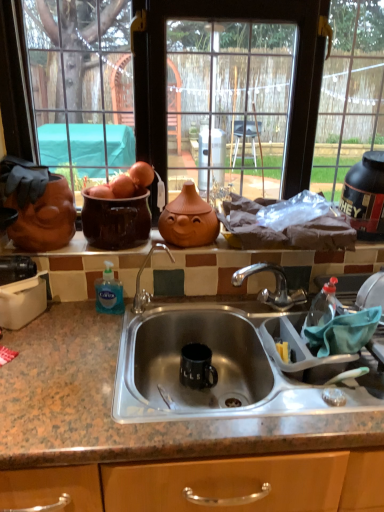
Question: Considering the relative positions of matte glass window at upper center and black rubber protein container at upper right in the image provided, is matte glass window at upper center behind black rubber protein container at upper right?

Choices:
 (A) yes
 (B) no

Answer: (B)

Question: From a real-world perspective, is matte glass window at upper center positioned under black rubber protein container at upper right based on gravity?

Choices:
 (A) yes
 (B) no

Answer: (B)

Question: From a real-world perspective, is matte glass window at upper center on top of black rubber protein container at upper right?

Choices:
 (A) yes
 (B) no

Answer: (A)

Question: From the image's perspective, is matte glass window at upper center located beneath black rubber protein container at upper right?

Choices:
 (A) yes
 (B) no

Answer: (B)

Question: Is matte glass window at upper center thinner than black rubber protein container at upper right?

Choices:
 (A) yes
 (B) no

Answer: (B)

Question: Is matte glass window at upper center located outside black rubber protein container at upper right?

Choices:
 (A) yes
 (B) no

Answer: (A)

Question: Does blue translucent liquid soap at sink left lie behind black rubber protein container at upper right?

Choices:
 (A) yes
 (B) no

Answer: (B)

Question: From the image's perspective, is blue translucent liquid soap at sink left beneath black rubber protein container at upper right?

Choices:
 (A) no
 (B) yes

Answer: (B)

Question: Considering the relative sizes of blue translucent liquid soap at sink left and black rubber protein container at upper right in the image provided, is blue translucent liquid soap at sink left bigger than black rubber protein container at upper right?

Choices:
 (A) yes
 (B) no

Answer: (B)

Question: Can you confirm if blue translucent liquid soap at sink left is wider than black rubber protein container at upper right?

Choices:
 (A) no
 (B) yes

Answer: (A)

Question: Can you see blue translucent liquid soap at sink left touching black rubber protein container at upper right?

Choices:
 (A) no
 (B) yes

Answer: (A)

Question: Would you say black rubber protein container at upper right is part of blue translucent liquid soap at sink left's contents?

Choices:
 (A) no
 (B) yes

Answer: (A)

Question: Is matte glass window at upper center with blue translucent liquid soap at sink left?

Choices:
 (A) no
 (B) yes

Answer: (A)